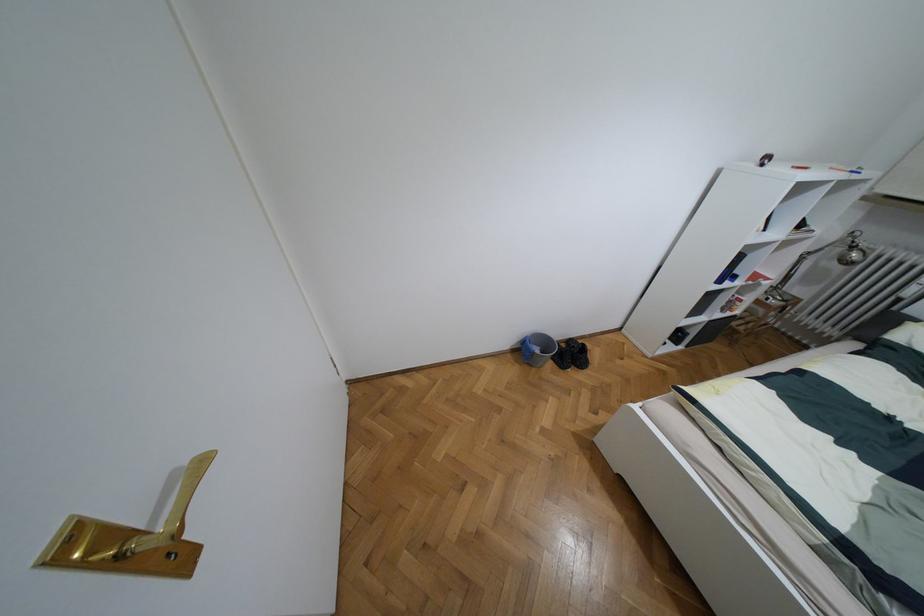
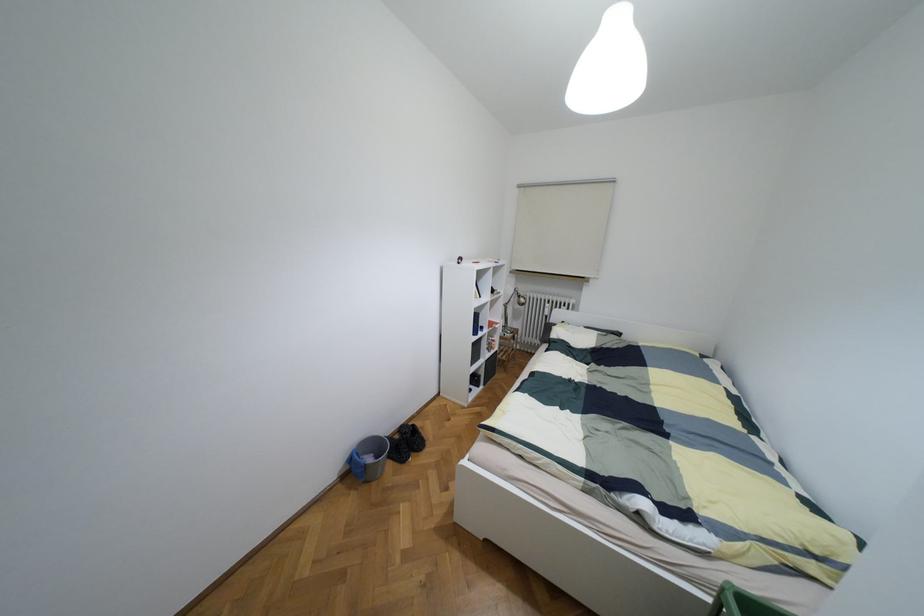
Find the pixel in the second image that matches [852,246] in the first image.

(517, 296)